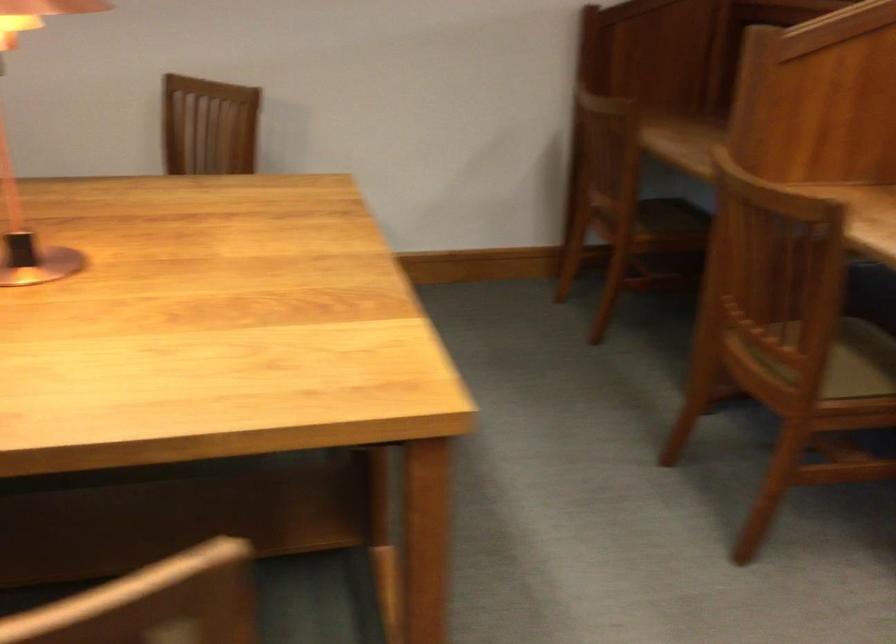
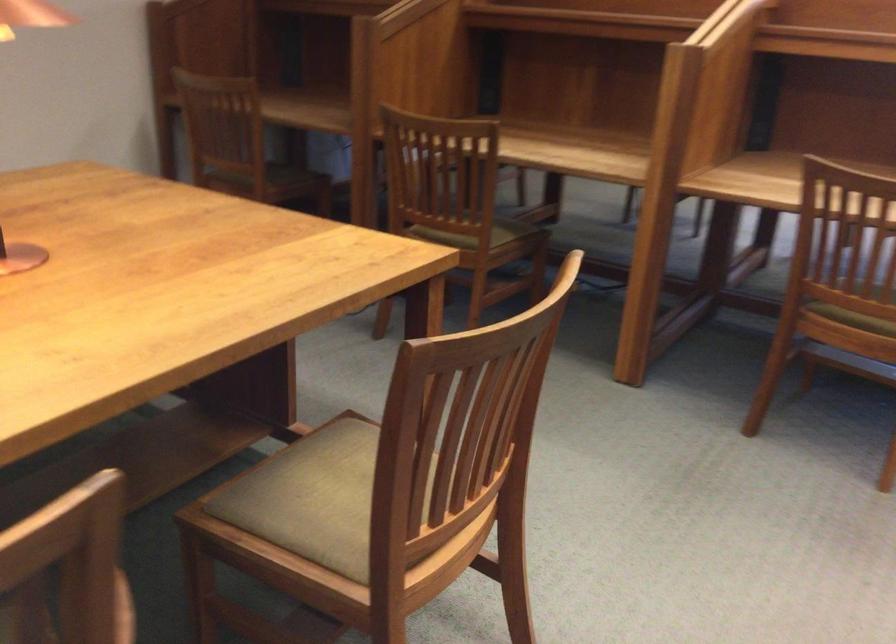
Locate, in the second image, the point that corresponds to the point at 627,232 in the first image.

(264, 182)